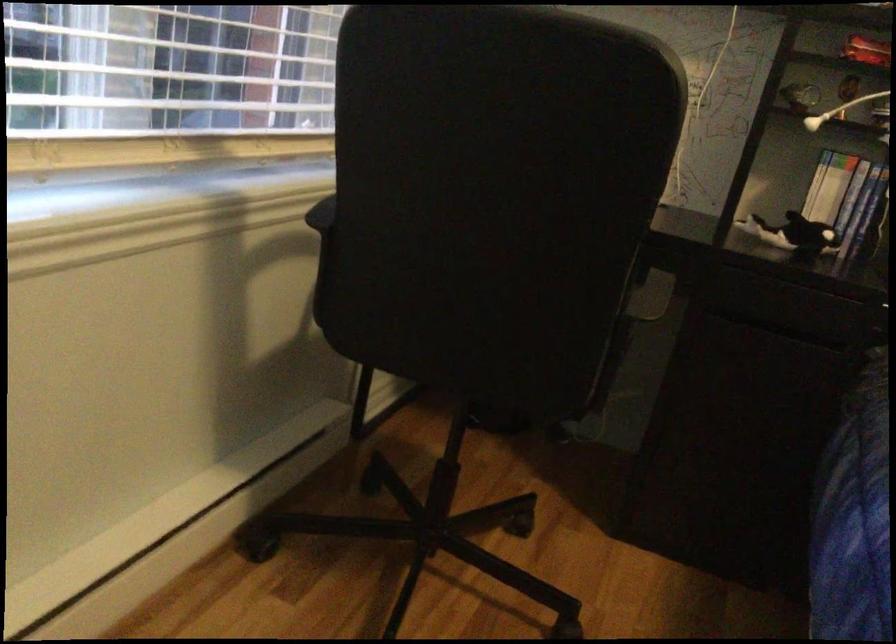
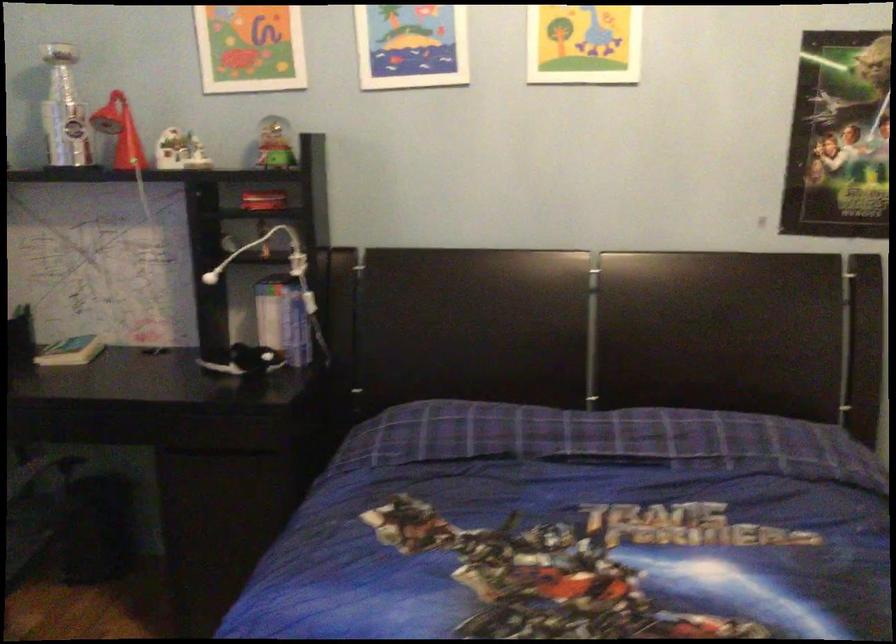
Which direction would the cameraman need to move to produce the second image?

The cameraman moved toward right, backward.